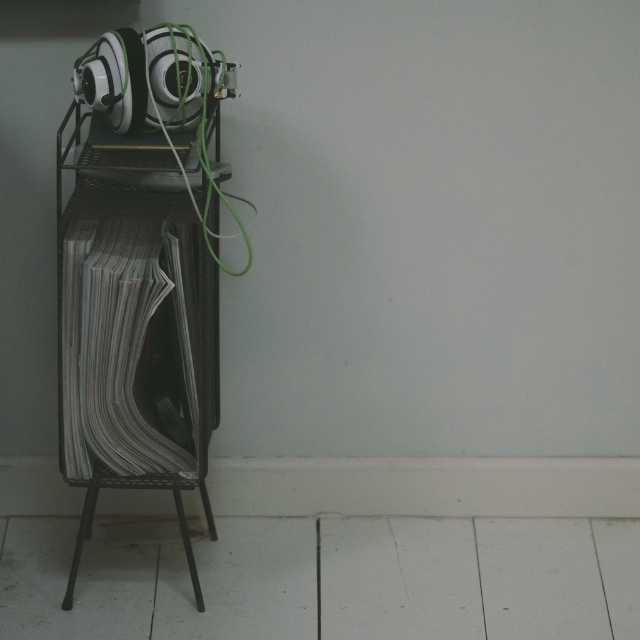
You are standing in the minimalist room and want to place a small decorative item between the two points, point (93, 54) and point (202, 486). Which point should you place it closer to in order to ensure it is more visible from your current position?

→ You should place the item closer to point (93, 54) because it is closer to the viewer than point (202, 486), making it more visible from your current position.

You are organizing a small event and need to place a decorative pillow that measures 30cm in width. You have two options in the image, the satin silver headphones at upper left and the metallic stool at lower left. Which object can the pillow fit next to without overlapping?

The pillow can fit next to the metallic stool at lower left because the satin silver headphones at upper left is smaller than the metallic stool at lower left, implying the stool has more space around it.

You are a delivery person trying to place a small box between the satin silver headphones at upper left and the metallic stool at lower left. Can you fit the box if it measures 24 inches in length?

The satin silver headphones at upper left is 25.39 inches away from the metallic stool at lower left. Since the box is 24 inches long, there is enough space to fit it between them.